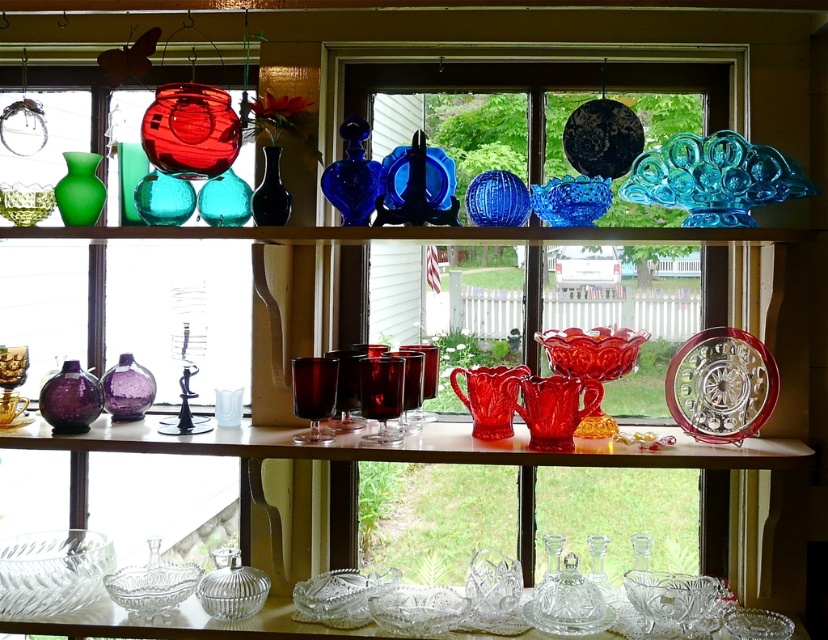
Question: Which object appears closest to the camera in this image?

Choices:
 (A) clear crystal bowl at center
 (B) matte green glass vase at left
 (C) clear crystal bowl at lower left
 (D) green glass vase at center

Answer: (A)

Question: Is purple glass vase at lower left thinner than matte green glass vase at left?

Choices:
 (A) yes
 (B) no

Answer: (B)

Question: Which point appears farthest from the camera in this image?

Choices:
 (A) (393, 609)
 (B) (132, 356)

Answer: (B)

Question: Which point is farther from the camera taking this photo?

Choices:
 (A) (415, 448)
 (B) (55, 538)
 (C) (114, 406)
 (D) (700, 120)

Answer: (D)

Question: Is ruby glassware at center thinner than purple glass vase at center?

Choices:
 (A) no
 (B) yes

Answer: (A)

Question: Does clear crystal bowl at center have a lesser width compared to purple glass vase at lower left?

Choices:
 (A) no
 (B) yes

Answer: (A)